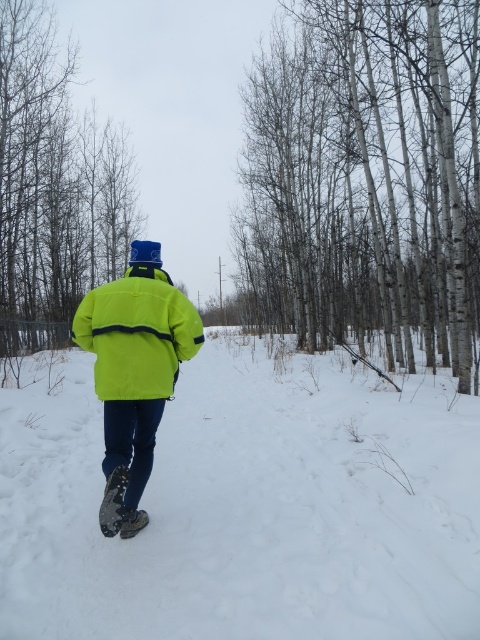
Question: Can you confirm if smooth white tree at center is positioned below bright yellow jacket at center?

Choices:
 (A) yes
 (B) no

Answer: (B)

Question: Is smooth white tree at center above bright yellow jacket at center?

Choices:
 (A) yes
 (B) no

Answer: (A)

Question: Is the position of smooth gray tree trunk at center more distant than that of bright yellow jacket at center?

Choices:
 (A) yes
 (B) no

Answer: (A)

Question: Among these objects, which one is nearest to the camera?

Choices:
 (A) smooth gray tree trunk at center
 (B) bright yellow jacket at center
 (C) neon yellow jacket at center

Answer: (C)

Question: Which object appears closest to the camera in this image?

Choices:
 (A) neon yellow jacket at center
 (B) smooth gray tree trunk at center
 (C) smooth white tree at center
 (D) white fluffy snow at center

Answer: (A)

Question: Based on their relative distances, which object is farther from the smooth gray tree trunk at center?

Choices:
 (A) smooth white tree at center
 (B) bright yellow jacket at center
 (C) neon yellow jacket at center

Answer: (B)